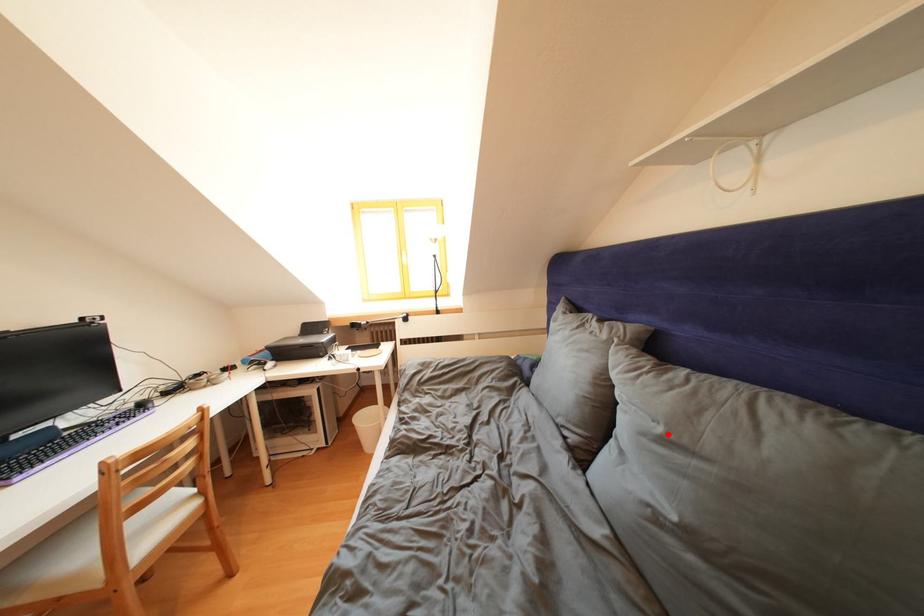
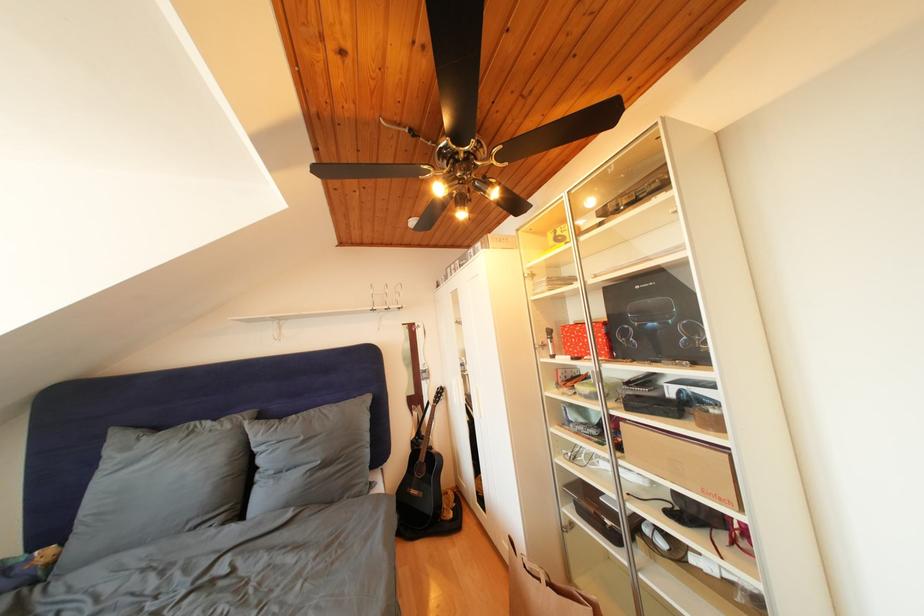
Find the pixel in the second image that matches the highlighted location in the first image.

(310, 444)